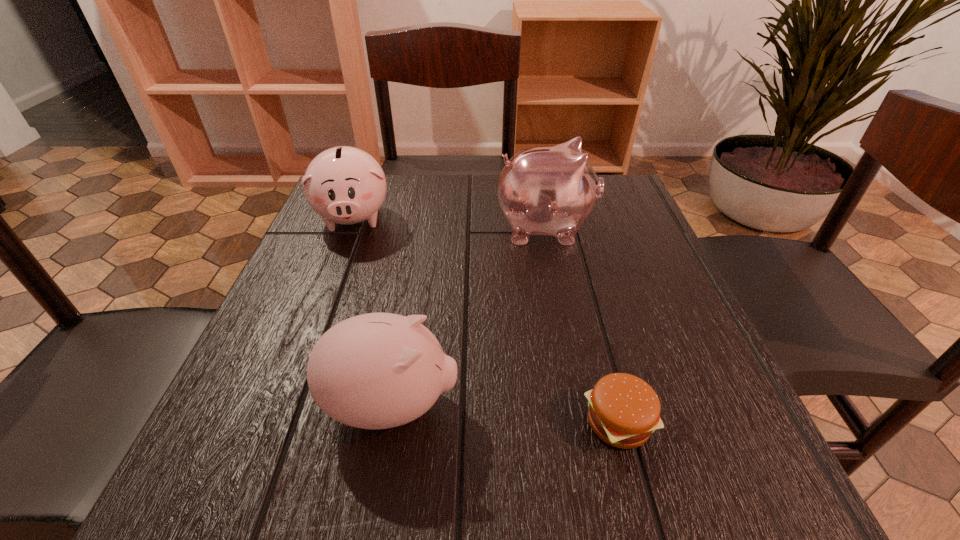
What are the coordinates of `the tallest object` in the screenshot? It's located at (551, 190).

This screenshot has height=540, width=960. I want to click on the rightmost piggy bank, so click(x=551, y=190).

Locate an element on the screen. The image size is (960, 540). the nearest piggy bank is located at coordinates (377, 370).

Locate an element on the screen. hamburger is located at coordinates (624, 410).

At what (x,y) coordinates should I click in order to perform the action: click on free location located 0.100m on the front facing side of the tallest object. Please return your answer as a coordinate pair (x, y). The image size is (960, 540). Looking at the image, I should click on (640, 228).

Image resolution: width=960 pixels, height=540 pixels. I want to click on free region located at the snout of the nearest piggy bank, so click(x=705, y=405).

Find the location of a particular element. free region located on the back of the shortest object is located at coordinates (588, 304).

I want to click on piggy bank at the near edge, so click(x=377, y=370).

Locate an element on the screen. hamburger located in the near edge section of the desktop is located at coordinates click(624, 410).

Find the location of `piggy bank present at the right edge`. piggy bank present at the right edge is located at coordinates (551, 190).